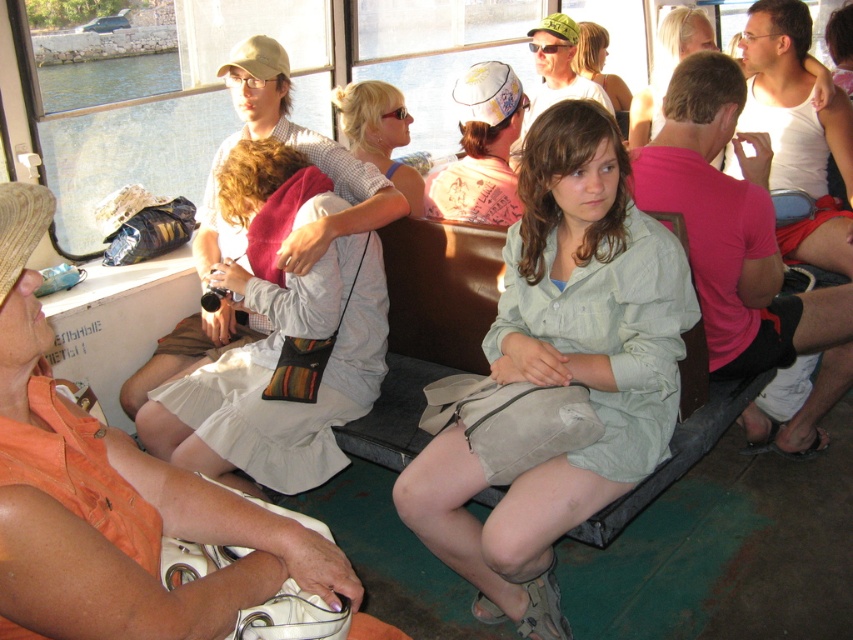
Question: Which point is farther to the camera?

Choices:
 (A) striped fabric bag at center
 (B) blonde hair at center
 (C) pink cotton shirt at center
 (D) pink fabric shirt at right

Answer: (B)

Question: Does pink fabric shirt at right have a smaller size compared to light blue fabric dress at center?

Choices:
 (A) yes
 (B) no

Answer: (B)

Question: Is the position of light green fabric dress at center more distant than that of light brown hair at center?

Choices:
 (A) no
 (B) yes

Answer: (A)

Question: Can you confirm if white cotton dress at center is smaller than blonde hair at center?

Choices:
 (A) yes
 (B) no

Answer: (A)

Question: Among these objects, which one is farthest from the camera?

Choices:
 (A) pink cotton shirt at center
 (B) light brown hair at center

Answer: (B)

Question: Estimate the real-world distances between objects in this image. Which object is closer to the pink cotton shirt at center?

Choices:
 (A) light blue fabric dress at center
 (B) light green fabric dress at center
 (C) pink fabric shirt at right
 (D) white cotton dress at center

Answer: (A)